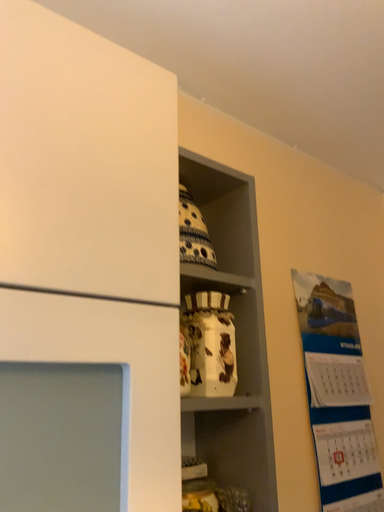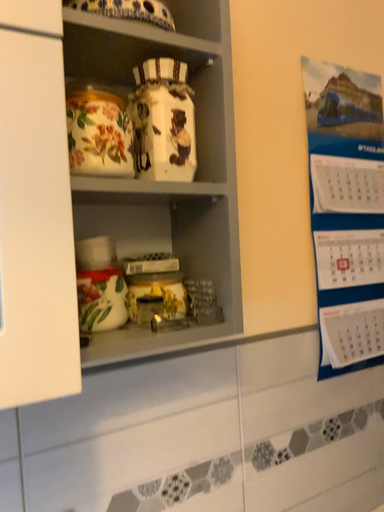
Question: How did the camera likely rotate when shooting the video?

Choices:
 (A) rotated right
 (B) rotated left

Answer: (B)